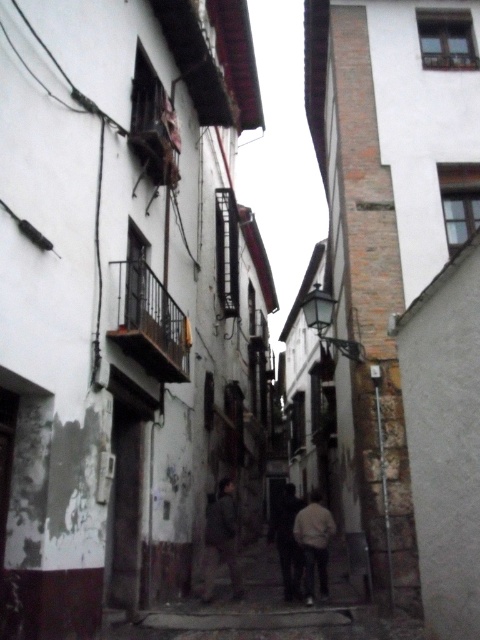
Can you confirm if dark gray fabric couple at center is positioned above light beige fabric jacket at center?

Actually, dark gray fabric couple at center is below light beige fabric jacket at center.

Which of these two, dark gray fabric couple at center or light beige fabric jacket at center, stands taller?

light beige fabric jacket at center is taller.

Describe the element at coordinates (222, 541) in the screenshot. The image size is (480, 640). I see `dark gray fabric couple at center` at that location.

The height and width of the screenshot is (640, 480). In order to click on dark gray fabric couple at center in this screenshot , I will do `click(222, 541)`.

Does dark gray fabric couple at center have a smaller size compared to dark gray fabric jacket at center?

Yes, dark gray fabric couple at center is smaller than dark gray fabric jacket at center.

The image size is (480, 640). What do you see at coordinates (222, 541) in the screenshot?
I see `dark gray fabric couple at center` at bounding box center [222, 541].

Which is in front, point (288, 504) or point (228, 477)?

Positioned in front is point (288, 504).

Image resolution: width=480 pixels, height=640 pixels. Find the location of `dark gray fabric couple at center`. dark gray fabric couple at center is located at coordinates (222, 541).

Which is above, dark gray fabric jacket at center or dark gray fabric pants at center?

dark gray fabric jacket at center is above.

Does dark gray fabric jacket at center have a larger size compared to dark gray fabric pants at center?

Incorrect, dark gray fabric jacket at center is not larger than dark gray fabric pants at center.

Is point (219, 545) positioned in front of point (294, 570)?

That is True.

Locate an element on the screen. dark gray fabric jacket at center is located at coordinates (222, 540).